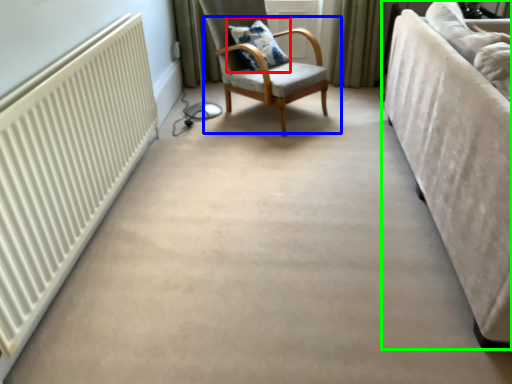
Question: Which object is positioned farthest from pillow (highlighted by a red box)? Select from chair (highlighted by a blue box) and studio couch (highlighted by a green box).

Choices:
 (A) chair
 (B) studio couch

Answer: (B)